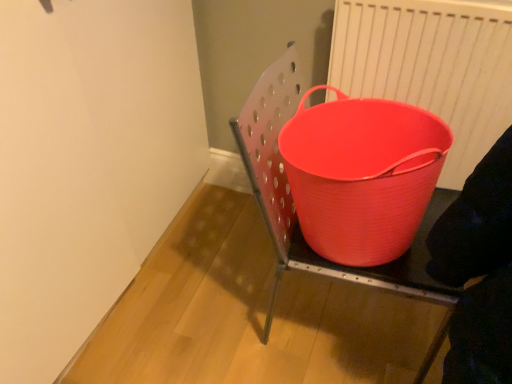
Question: Is matte plastic bucket at center a part of matte plastic bucket at center?

Choices:
 (A) no
 (B) yes

Answer: (A)

Question: Considering the relative sizes of matte plastic bucket at center and matte plastic bucket at center in the image provided, is matte plastic bucket at center shorter than matte plastic bucket at center?

Choices:
 (A) no
 (B) yes

Answer: (B)

Question: Could you tell me if matte plastic bucket at center is turned towards matte plastic bucket at center?

Choices:
 (A) yes
 (B) no

Answer: (A)

Question: From the image's perspective, does matte plastic bucket at center appear lower than matte plastic bucket at center?

Choices:
 (A) no
 (B) yes

Answer: (A)

Question: Can you confirm if matte plastic bucket at center is thinner than matte plastic bucket at center?

Choices:
 (A) yes
 (B) no

Answer: (A)

Question: Is matte plastic bucket at center at the back of matte plastic bucket at center?

Choices:
 (A) yes
 (B) no

Answer: (A)

Question: From a real-world perspective, does matte plastic bucket at right sit lower than white plastic radiator at upper right?

Choices:
 (A) yes
 (B) no

Answer: (A)

Question: Considering the relative sizes of matte plastic bucket at right and white plastic radiator at upper right in the image provided, is matte plastic bucket at right shorter than white plastic radiator at upper right?

Choices:
 (A) yes
 (B) no

Answer: (A)

Question: Is the depth of matte plastic bucket at right less than that of white plastic radiator at upper right?

Choices:
 (A) yes
 (B) no

Answer: (A)

Question: Is the depth of matte plastic bucket at right greater than that of white plastic radiator at upper right?

Choices:
 (A) yes
 (B) no

Answer: (B)

Question: Can you confirm if matte plastic bucket at right is wider than white plastic radiator at upper right?

Choices:
 (A) no
 (B) yes

Answer: (B)

Question: Is matte plastic bucket at right looking in the opposite direction of white plastic radiator at upper right?

Choices:
 (A) yes
 (B) no

Answer: (B)

Question: Is matte plastic bucket at center oriented away from matte plastic bucket at right?

Choices:
 (A) no
 (B) yes

Answer: (A)